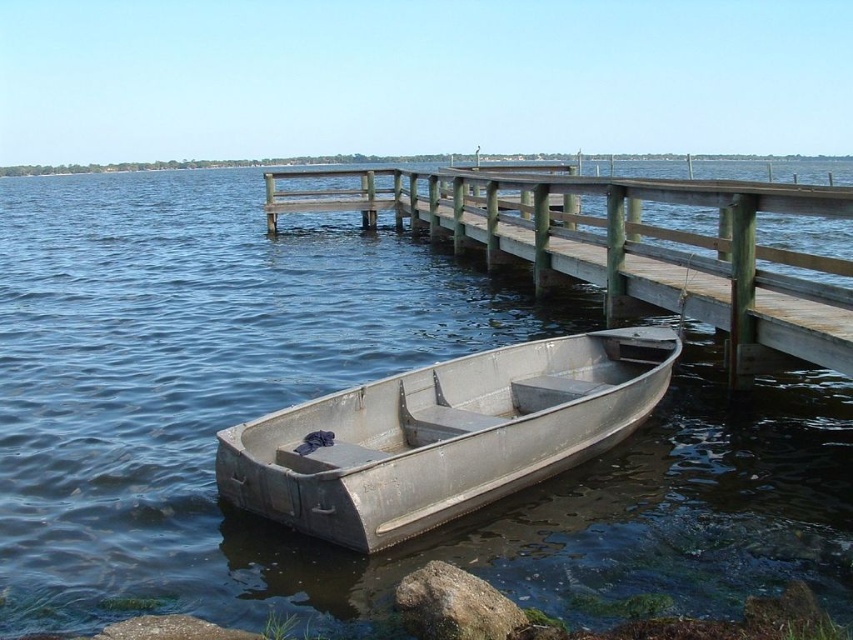
You are standing on the dock and want to reach the metallic water at center. The boat is anchored 4.94 meters away from you. If your maximum reach is 2 meters, can you grab the boat without getting into the water?

The metallic water at center is 4.94 meters away from you. Since your maximum reach is only 2 meters, you cannot grab the boat without entering the water.